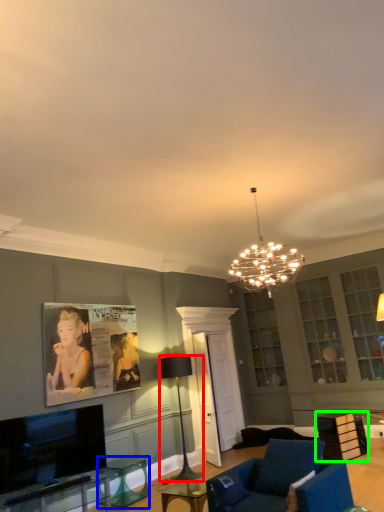
Question: Which object is the farthest from lamp (highlighted by a red box)? Choose among these: round table (highlighted by a blue box) or table (highlighted by a green box).

Choices:
 (A) round table
 (B) table

Answer: (B)